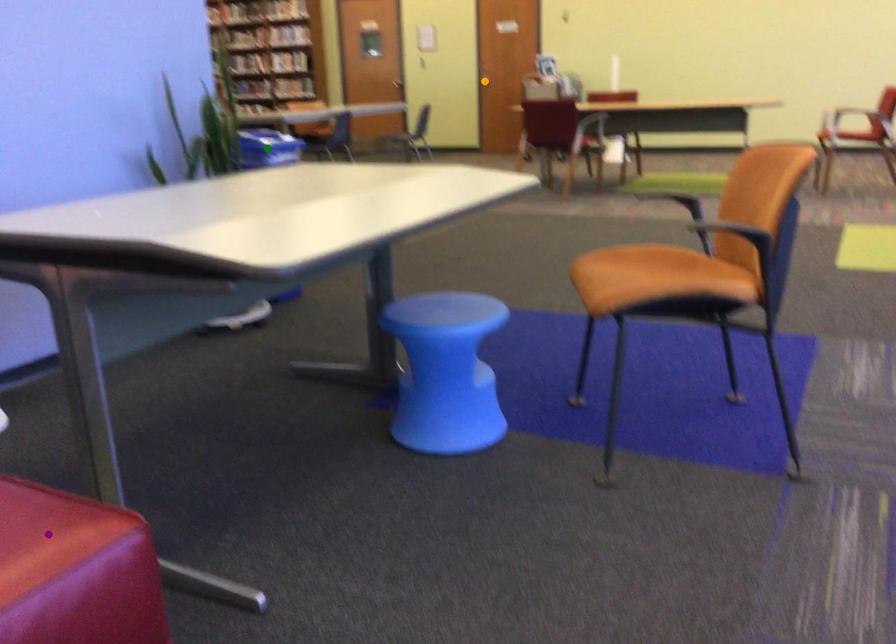
Order these from nearest to farthest:
green point | purple point | orange point

purple point < green point < orange point